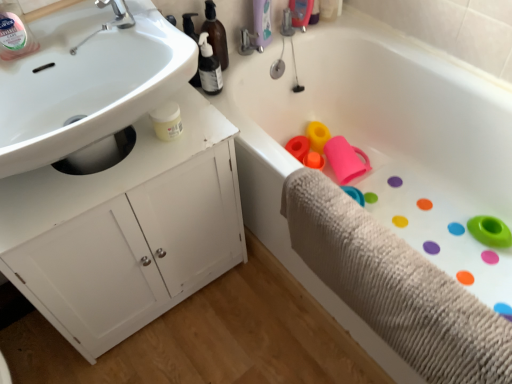
Identify the location of vacant area situated to the left side of silver metallic faucet at upper left. (75, 26).